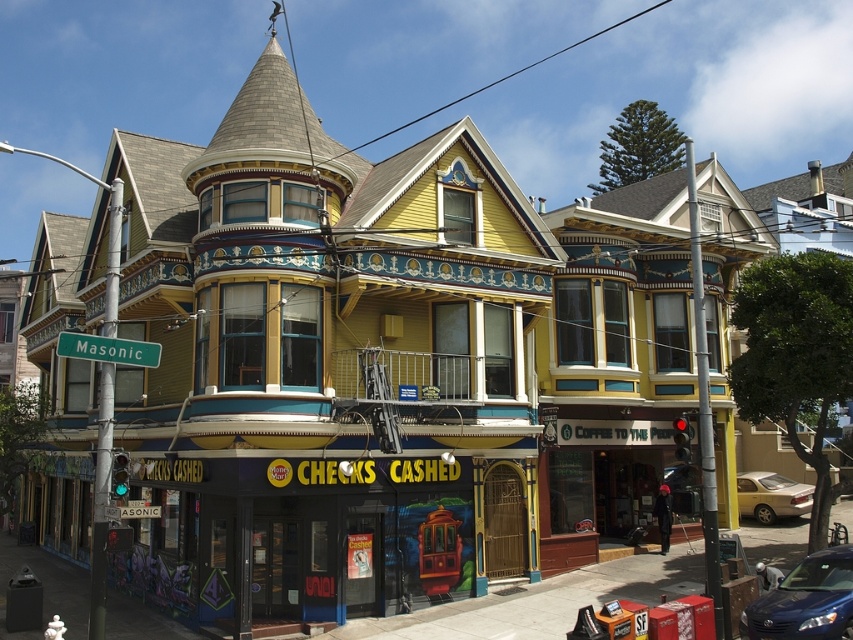
Question: Which object is positioned farthest from the green metallic street sign at left?

Choices:
 (A) blue metallic sedan at lower right
 (B) silver metallic sedan at lower right

Answer: (B)

Question: Can you confirm if blue metallic sedan at lower right is positioned to the right of green metallic street sign at left?

Choices:
 (A) no
 (B) yes

Answer: (B)

Question: Can you confirm if blue metallic sedan at lower right is positioned to the right of silver metallic sedan at lower right?

Choices:
 (A) yes
 (B) no

Answer: (B)

Question: Estimate the real-world distances between objects in this image. Which object is closer to the green metallic street sign at left?

Choices:
 (A) silver metallic sedan at lower right
 (B) blue metallic sedan at lower right

Answer: (B)

Question: Among these objects, which one is farthest from the camera?

Choices:
 (A) silver metallic sedan at lower right
 (B) blue metallic sedan at lower right
 (C) green metallic street sign at left

Answer: (A)

Question: From the image, what is the correct spatial relationship of blue metallic sedan at lower right in relation to green metallic street sign at left?

Choices:
 (A) below
 (B) above

Answer: (A)